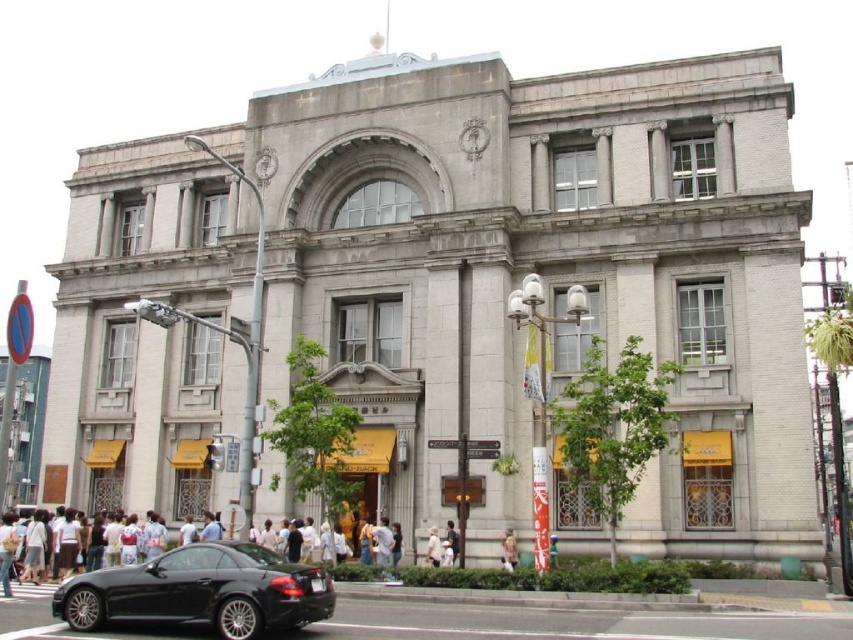
Can you confirm if light brown fabric bag at lower center is wider than white cotton shirt at center?

No.

Does light brown fabric bag at lower center have a greater height compared to white cotton shirt at center?

In fact, light brown fabric bag at lower center may be shorter than white cotton shirt at center.

In order to click on light brown fabric bag at lower center in this screenshot , I will do `click(509, 550)`.

You are a GUI agent. You are given a task and a screenshot of the screen. Output one action in this format:
    pyautogui.click(x=<x>, y=<y>)
    Task: Click on the light brown fabric bag at lower center
    Image resolution: width=853 pixels, height=640 pixels.
    Given the screenshot: What is the action you would take?
    pyautogui.click(x=509, y=550)

Between shiny black car at center and white cotton shirt at center, which one appears on the right side from the viewer's perspective?

white cotton shirt at center is more to the right.

Can you confirm if shiny black car at center is thinner than white cotton shirt at center?

No.

Who is more forward, (x=228, y=540) or (x=428, y=529)?

Point (x=228, y=540) is in front.

Where is `shiny black car at center`? The height and width of the screenshot is (640, 853). shiny black car at center is located at coordinates (201, 592).

Is shiny black car at center thinner than light brown fabric bag at lower center?

→ Incorrect, shiny black car at center's width is not less than light brown fabric bag at lower center's.

Who is more distant from viewer, (241, 580) or (509, 545)?

Point (509, 545)

Find the location of a particular element. The image size is (853, 640). shiny black car at center is located at coordinates (201, 592).